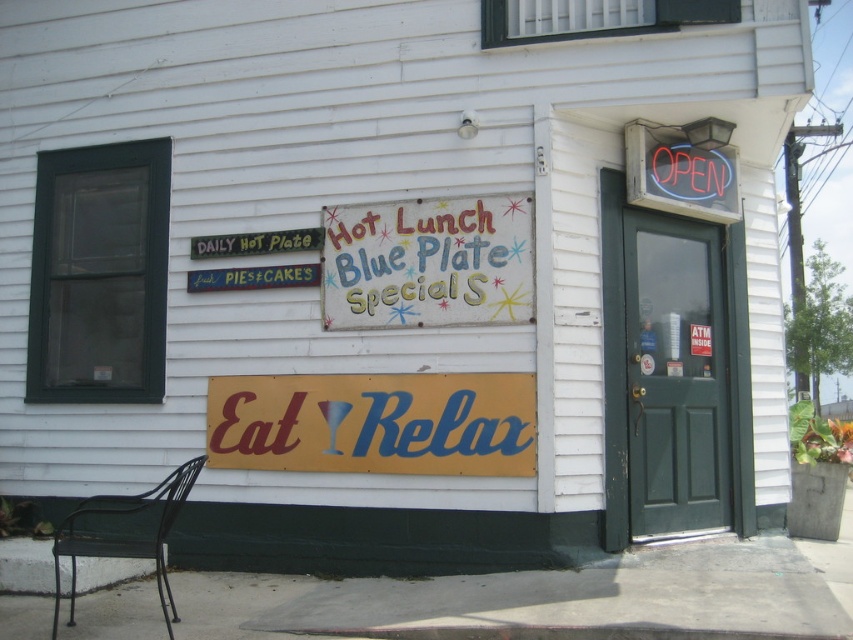
Can you confirm if yellow matte sign at center is thinner than black wrought iron chair at lower left?

No, yellow matte sign at center is not thinner than black wrought iron chair at lower left.

Is yellow matte sign at center taller than black wrought iron chair at lower left?

No.

Is point (517, 376) more distant than point (86, 550)?

Yes, point (517, 376) is behind point (86, 550).

Locate an element on the screen. Image resolution: width=853 pixels, height=640 pixels. yellow matte sign at center is located at coordinates (374, 422).

Does painted wood signboard at center appear under black wrought iron chair at lower left?

No.

Does point (498, 307) lie in front of point (143, 513)?

Yes, point (498, 307) is in front of point (143, 513).

At what (x,y) coordinates should I click in order to perform the action: click on painted wood signboard at center. Please return your answer as a coordinate pair (x, y). Looking at the image, I should click on click(428, 262).

Who is taller, yellow matte sign at center or painted wood signboard at center?

Standing taller between the two is painted wood signboard at center.

Between yellow matte sign at center and painted wood signboard at center, which one appears on the right side from the viewer's perspective?

Positioned to the right is painted wood signboard at center.

This screenshot has width=853, height=640. Find the location of `yellow matte sign at center`. yellow matte sign at center is located at coordinates (374, 422).

Image resolution: width=853 pixels, height=640 pixels. Find the location of `yellow matte sign at center`. yellow matte sign at center is located at coordinates (374, 422).